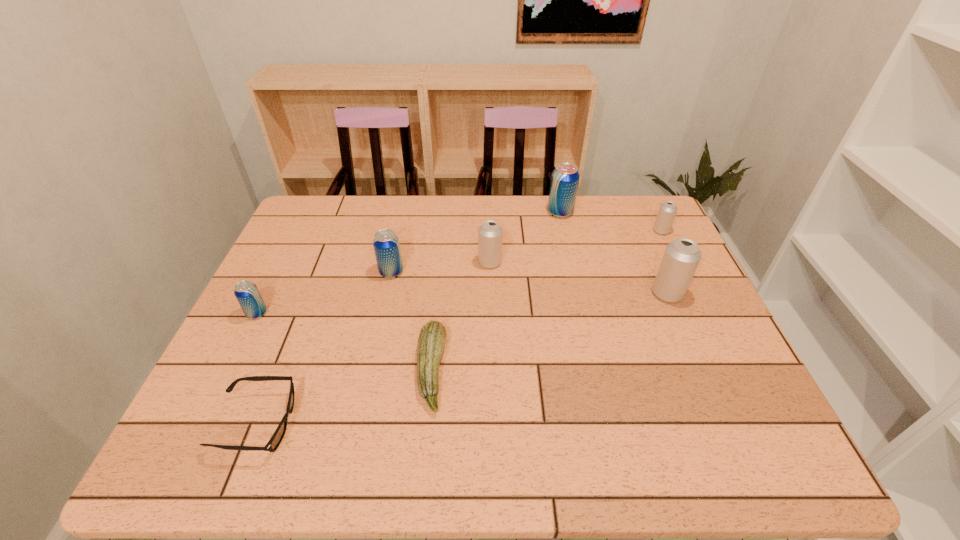
Locate an element on the screen. free space at the near edge of the desktop is located at coordinates [624, 434].

The width and height of the screenshot is (960, 540). Find the location of `vacant space at the left edge of the desktop`. vacant space at the left edge of the desktop is located at coordinates (273, 332).

In the image, there is a desktop. At what (x,y) coordinates should I click in order to perform the action: click on vacant space at the right edge. Please return your answer as a coordinate pair (x, y). The image size is (960, 540). Looking at the image, I should click on (711, 386).

The image size is (960, 540). What are the coordinates of `vacant region at the far left corner` in the screenshot? It's located at (316, 212).

Locate an element on the screen. vacant point located between the third nearest object and the fourth object from right to left is located at coordinates (373, 288).

Image resolution: width=960 pixels, height=540 pixels. In order to click on vacant region between the leftmost blue beer can and the fourth object from right to left in this screenshot , I will do `click(373, 288)`.

You are a GUI agent. You are given a task and a screenshot of the screen. Output one action in this format:
    pyautogui.click(x=<x>, y=<y>)
    Task: Click on the unoccupied position between the second farthest object and the seventh object from right to left
    
    Given the screenshot: What is the action you would take?
    pyautogui.click(x=459, y=327)

Find the location of a particular element. blank region between the seventh object from right to left and the fifth beer can from right to left is located at coordinates (324, 347).

Where is `blank region between the nearest white beer can and the zucchini`? Image resolution: width=960 pixels, height=540 pixels. blank region between the nearest white beer can and the zucchini is located at coordinates (549, 332).

Where is `vacant area between the fifth nearest beer can and the sunglasses`? Image resolution: width=960 pixels, height=540 pixels. vacant area between the fifth nearest beer can and the sunglasses is located at coordinates (459, 327).